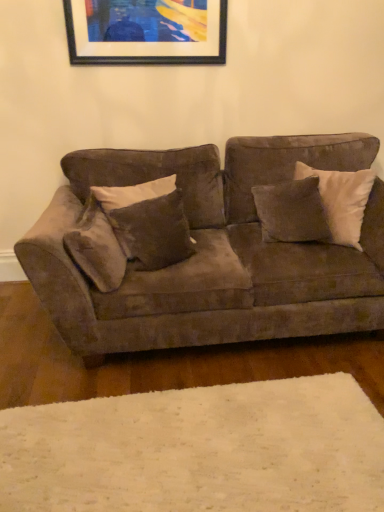
Question: Should I look upward or downward to see white soft rug at lower center?

Choices:
 (A) down
 (B) up

Answer: (A)

Question: Does suede-like brown pillow at center, acting as the 3th pillow starting from the left, have a greater width compared to suede-like brown pillow at left, positioned as the first pillow in left-to-right order?

Choices:
 (A) yes
 (B) no

Answer: (A)

Question: Considering the relative sizes of suede-like brown pillow at center, arranged as the first pillow when viewed from the right, and suede-like brown pillow at left, the third pillow in the right-to-left sequence, in the image provided, is suede-like brown pillow at center, arranged as the first pillow when viewed from the right, thinner than suede-like brown pillow at left, the third pillow in the right-to-left sequence,?

Choices:
 (A) yes
 (B) no

Answer: (B)

Question: Is suede-like brown pillow at center, acting as the 3th pillow starting from the left, in contact with suede-like brown pillow at left, the third pillow in the right-to-left sequence?

Choices:
 (A) no
 (B) yes

Answer: (A)

Question: Is suede-like brown pillow at center, arranged as the first pillow when viewed from the right, far away from suede-like brown pillow at left, positioned as the first pillow in left-to-right order?

Choices:
 (A) no
 (B) yes

Answer: (A)

Question: Can you confirm if suede-like brown pillow at center, acting as the 3th pillow starting from the left, is bigger than suede-like brown pillow at left, positioned as the first pillow in left-to-right order?

Choices:
 (A) yes
 (B) no

Answer: (B)

Question: From a real-world perspective, is suede-like brown pillow at center, arranged as the first pillow when viewed from the right, below suede-like brown pillow at left, positioned as the first pillow in left-to-right order?

Choices:
 (A) yes
 (B) no

Answer: (B)

Question: From the image's perspective, would you say black matte picture frame at upper center is shown under suede-like brown pillow at center, arranged as the first pillow when viewed from the right?

Choices:
 (A) no
 (B) yes

Answer: (A)

Question: Is suede-like brown pillow at center, arranged as the first pillow when viewed from the right, at the back of black matte picture frame at upper center?

Choices:
 (A) no
 (B) yes

Answer: (A)

Question: Is black matte picture frame at upper center surrounding suede-like brown pillow at center, arranged as the first pillow when viewed from the right?

Choices:
 (A) yes
 (B) no

Answer: (B)

Question: Does black matte picture frame at upper center have a lesser height compared to suede-like brown pillow at center, acting as the 3th pillow starting from the left?

Choices:
 (A) yes
 (B) no

Answer: (A)

Question: Is black matte picture frame at upper center closer to the viewer compared to suede-like brown pillow at center, arranged as the first pillow when viewed from the right?

Choices:
 (A) no
 (B) yes

Answer: (A)

Question: Considering the relative sizes of black matte picture frame at upper center and suede-like brown pillow at center, acting as the 3th pillow starting from the left, in the image provided, is black matte picture frame at upper center taller than suede-like brown pillow at center, acting as the 3th pillow starting from the left,?

Choices:
 (A) yes
 (B) no

Answer: (B)

Question: Is white soft rug at lower center at the left side of suede-like brown pillow at left, the third pillow in the right-to-left sequence?

Choices:
 (A) yes
 (B) no

Answer: (B)